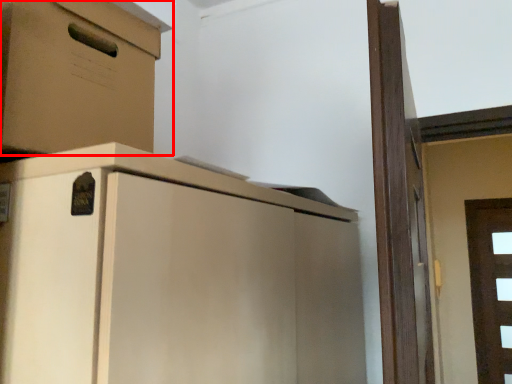
Question: From the image's perspective, considering the relative positions of cabinetry (annotated by the red box) and door in the image provided, where is cabinetry (annotated by the red box) located with respect to the staircase?

Choices:
 (A) above
 (B) below

Answer: (A)